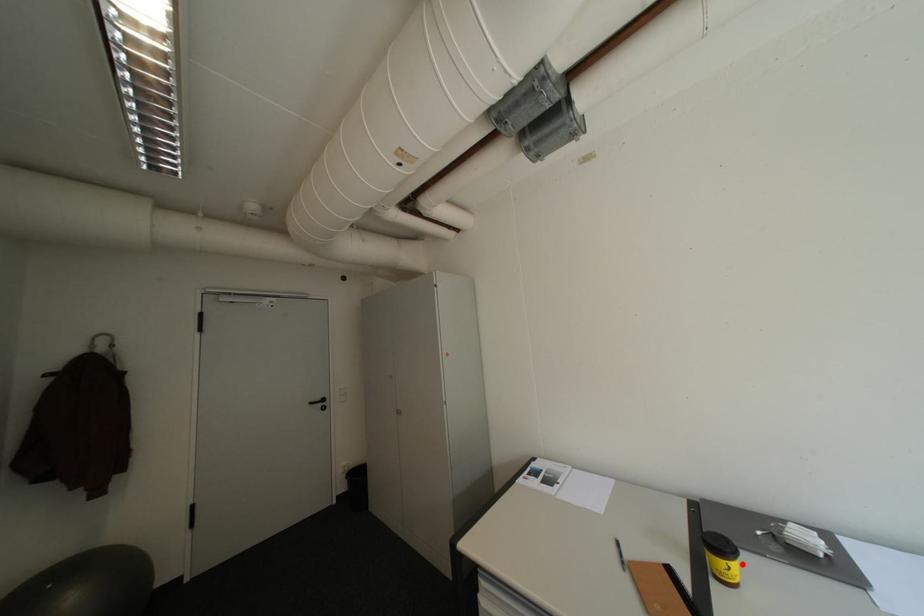
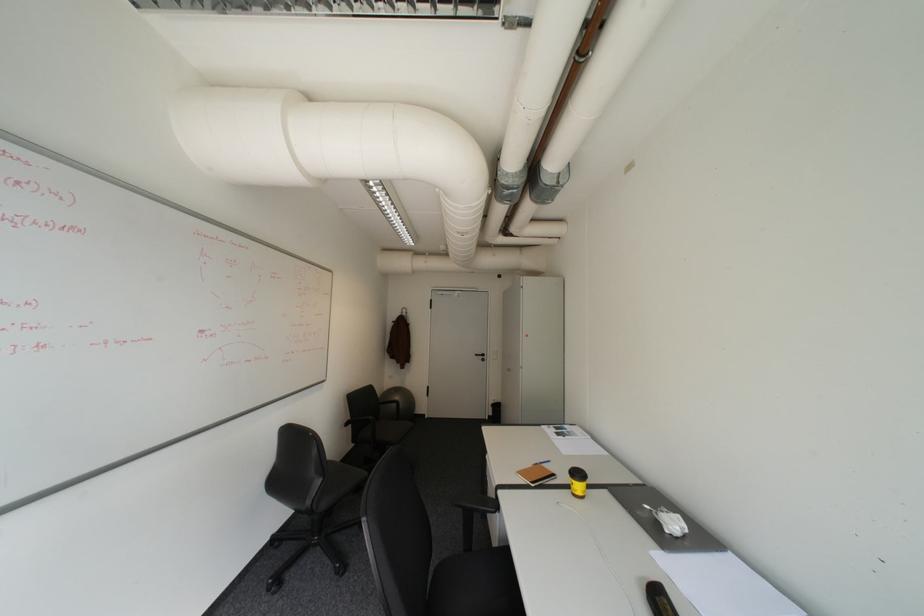
Locate, in the second image, the point that corresponds to the highlighted location in the first image.

(584, 482)